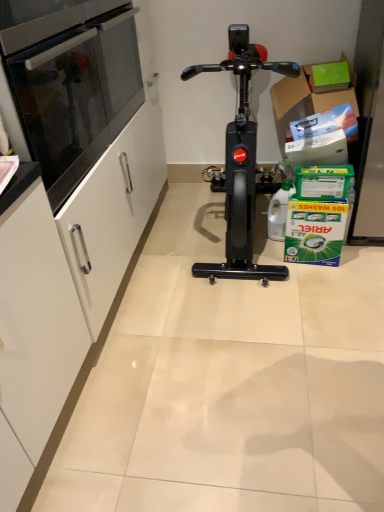
In order to face black glass oven at left, should I rotate leftwards or rightwards?

To face it directly, rotate left by 22.897 degrees.

I want to click on black glossy stationary bicycle at center, so click(x=241, y=163).

From a real-world perspective, which is physically below, green cardboard box at upper right or black granite countertop at left?

green cardboard box at upper right, from a real-world perspective.

Is green cardboard box at upper right spatially inside black granite countertop at left, or outside of it?

green cardboard box at upper right is not inside black granite countertop at left, it's outside.

From the image's perspective, is green cardboard box at upper right located above black granite countertop at left?

Yes, from the image's perspective, green cardboard box at upper right is above black granite countertop at left.

Based on the photo, which is more to the right, green cardboard box at upper right or black granite countertop at left?

From the viewer's perspective, green cardboard box at upper right appears more on the right side.

From a real-world perspective, is black glass oven at left on top of green cardboard box at upper right?

Yes, from a real-world perspective, black glass oven at left is over green cardboard box at upper right

Considering the relative sizes of black glass oven at left and green cardboard box at upper right in the image provided, is black glass oven at left thinner than green cardboard box at upper right?

In fact, black glass oven at left might be wider than green cardboard box at upper right.

Looking at the image, does black glass oven at left seem bigger or smaller compared to green cardboard box at upper right?

In the image, black glass oven at left appears to be larger than green cardboard box at upper right.

Is point (350, 65) positioned before point (0, 17)?

Yes, it is.

Is green cardboard box at upper right situated inside black glass oven at left or outside?

green cardboard box at upper right exists outside the volume of black glass oven at left.

Identify the location of oven to the left of green cardboard box at upper right. Image resolution: width=384 pixels, height=512 pixels. (70, 82).

Is black glossy stationary bicycle at center outside of black granite countertop at left?

black glossy stationary bicycle at center lies outside black granite countertop at left's area.

Is black glossy stationary bicycle at center directly adjacent to black granite countertop at left?

No, black glossy stationary bicycle at center is not making contact with black granite countertop at left.

Could you tell me if black glossy stationary bicycle at center is facing black granite countertop at left?

No, black glossy stationary bicycle at center is not facing towards black granite countertop at left.

Which is more to the right, black glossy stationary bicycle at center or black granite countertop at left?

Positioned to the right is black glossy stationary bicycle at center.

Which is more to the right, black glass oven at left or black glossy stationary bicycle at center?

black glossy stationary bicycle at center.

Where is `oven below the black glossy stationary bicycle at center (from the image's perspective)`? Image resolution: width=384 pixels, height=512 pixels. oven below the black glossy stationary bicycle at center (from the image's perspective) is located at coordinates (70, 82).

Is black glass oven at left aimed at black glossy stationary bicycle at center?

No, black glass oven at left does not turn towards black glossy stationary bicycle at center.

In the scene shown: Does black granite countertop at left have a smaller size compared to black glass oven at left?

Indeed, black granite countertop at left has a smaller size compared to black glass oven at left.

Considering the sizes of objects black granite countertop at left and black glass oven at left in the image provided, who is thinner, black granite countertop at left or black glass oven at left?

With smaller width is black granite countertop at left.

Is black granite countertop at left directly adjacent to black glass oven at left?

No.

Is black granite countertop at left facing towards black glass oven at left?

No, black granite countertop at left does not turn towards black glass oven at left.

What are the coordinates of `cardboard box lying on the right of black granite countertop at left` in the screenshot? It's located at (306, 99).

From the image's perspective, is black granite countertop at left above green cardboard box at upper right?

Actually, black granite countertop at left appears below green cardboard box at upper right in the image.

Can you confirm if black granite countertop at left is positioned to the left of green cardboard box at upper right?

Yes, black granite countertop at left is to the left of green cardboard box at upper right.

Where is `counter top above the green cardboard box at upper right (from a real-world perspective)`? The image size is (384, 512). counter top above the green cardboard box at upper right (from a real-world perspective) is located at coordinates (19, 184).

Locate an element on the screen. Image resolution: width=384 pixels, height=512 pixels. oven that appears on the left of green cardboard box at upper right is located at coordinates (70, 82).

When comparing their distances from green cardboard box at upper right, does black granite countertop at left or black glossy stationary bicycle at center seem closer?

black glossy stationary bicycle at center.

Which object lies further to the anchor point black granite countertop at left, black glossy stationary bicycle at center or black glass oven at left?

Among the two, black glossy stationary bicycle at center is located further to black granite countertop at left.

Based on their spatial positions, is green cardboard box at upper right or black glossy stationary bicycle at center further from black glass oven at left?

green cardboard box at upper right lies further to black glass oven at left than the other object.

Considering their positions, is black glossy stationary bicycle at center positioned closer to black glass oven at left than green cardboard box at upper right?

Among the two, black glossy stationary bicycle at center is located nearer to black glass oven at left.

Based on their spatial positions, is black glass oven at left or green cardboard box at upper right closer to black glossy stationary bicycle at center?

green cardboard box at upper right lies closer to black glossy stationary bicycle at center than the other object.

From the image, which object appears to be farther from green cardboard box at upper right, black glossy stationary bicycle at center or black granite countertop at left?

black granite countertop at left lies further to green cardboard box at upper right than the other object.

Estimate the real-world distances between objects in this image. Which object is further from green cardboard box at upper right, black glass oven at left or black glossy stationary bicycle at center?

black glass oven at left is positioned further to the anchor green cardboard box at upper right.

Looking at the image, which one is located further to black glass oven at left, black glossy stationary bicycle at center or black granite countertop at left?

Based on the image, black glossy stationary bicycle at center appears to be further to black glass oven at left.

Locate an element on the screen. Image resolution: width=384 pixels, height=512 pixels. counter top between black glass oven at left and green cardboard box at upper right is located at coordinates (19, 184).

I want to click on stationary bicycle situated between black granite countertop at left and green cardboard box at upper right from left to right, so click(x=241, y=163).

Where is `counter top situated between black glass oven at left and black glossy stationary bicycle at center from left to right`? counter top situated between black glass oven at left and black glossy stationary bicycle at center from left to right is located at coordinates (19, 184).

Find the location of a particular element. Image resolution: width=384 pixels, height=512 pixels. stationary bicycle between black glass oven at left and green cardboard box at upper right from left to right is located at coordinates (241, 163).